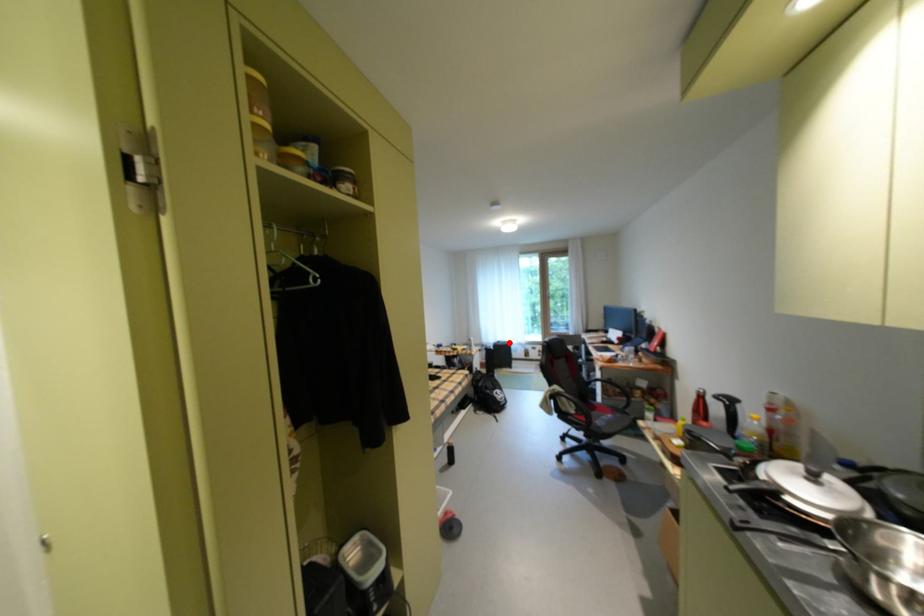
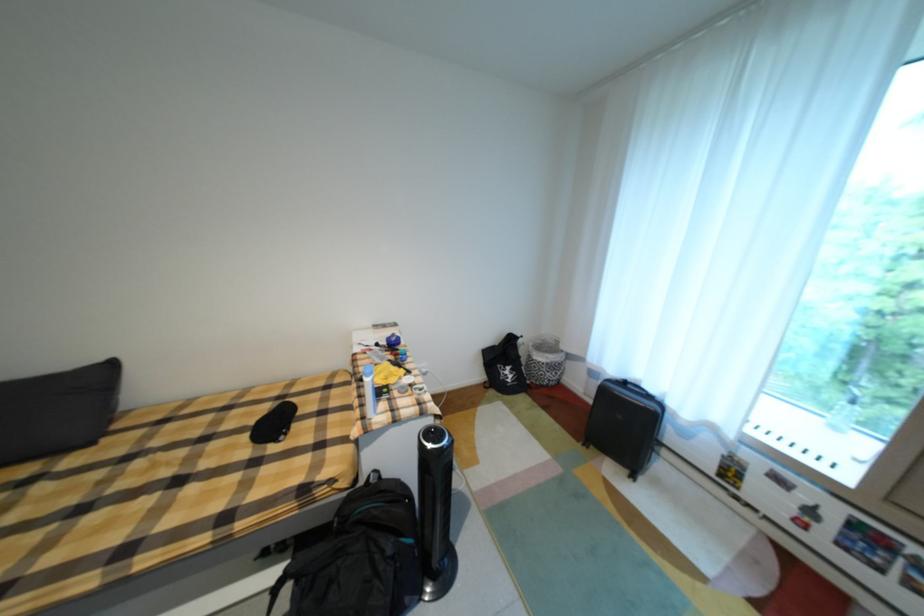
Question: A red point is marked in image1. In image2, is the corresponding 3D point closer to the camera or farther? Reply with the corresponding letter.

Choices:
 (A) The corresponding 3D point is closer.
 (B) The corresponding 3D point is farther.

Answer: (A)